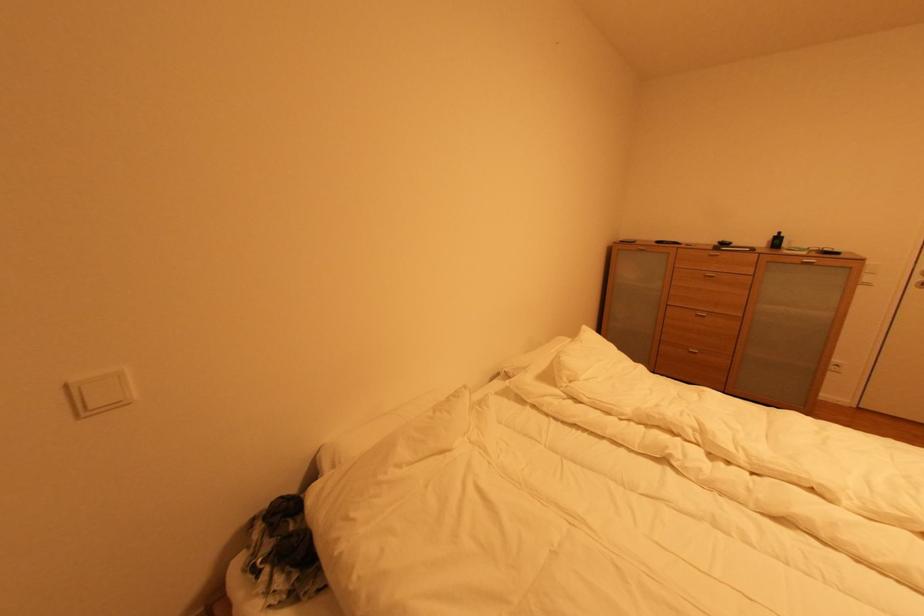
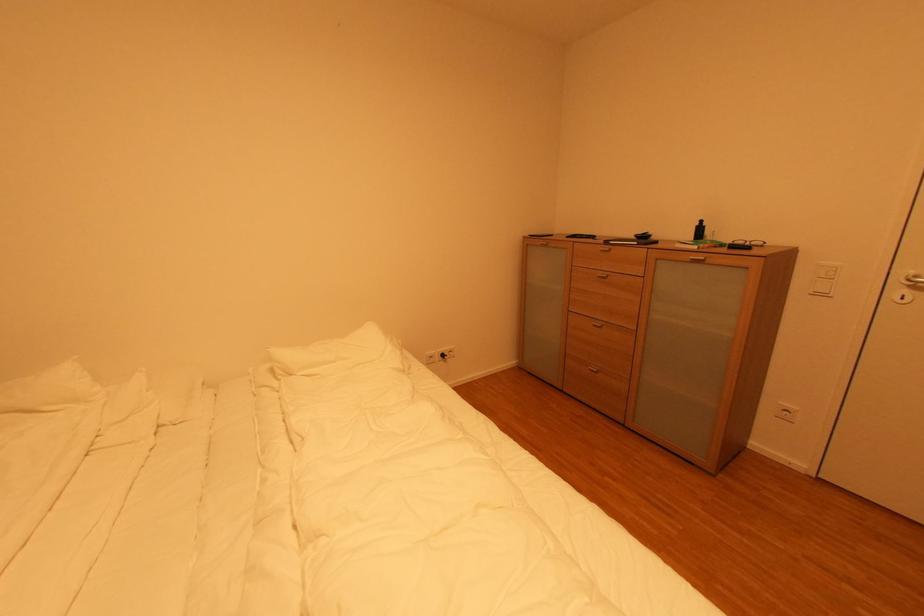
Question: Which direction would the cameraman need to move to produce the second image? Reply with the corresponding letter.

Choices:
 (A) Left
 (B) Right
 (C) Forward
 (D) Backward

Answer: (B)